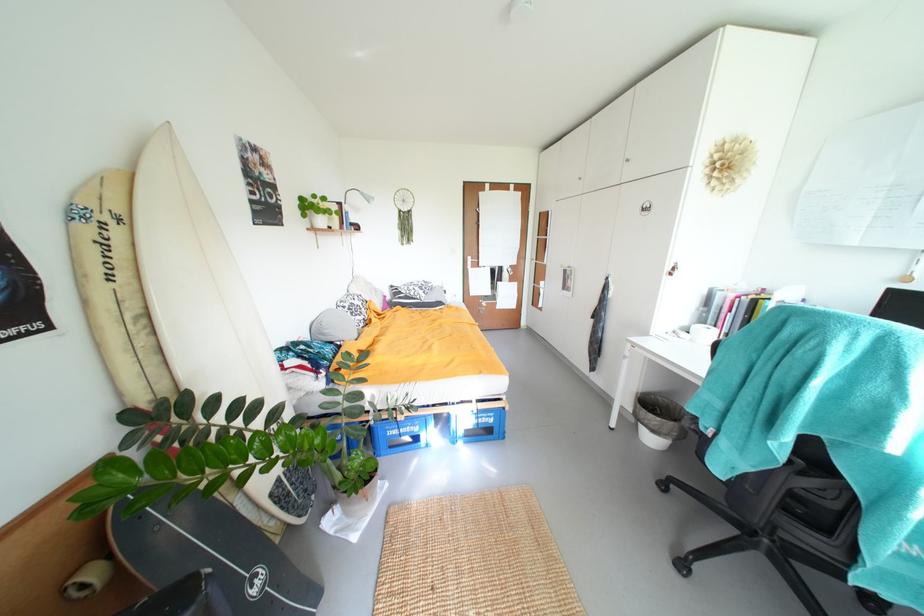
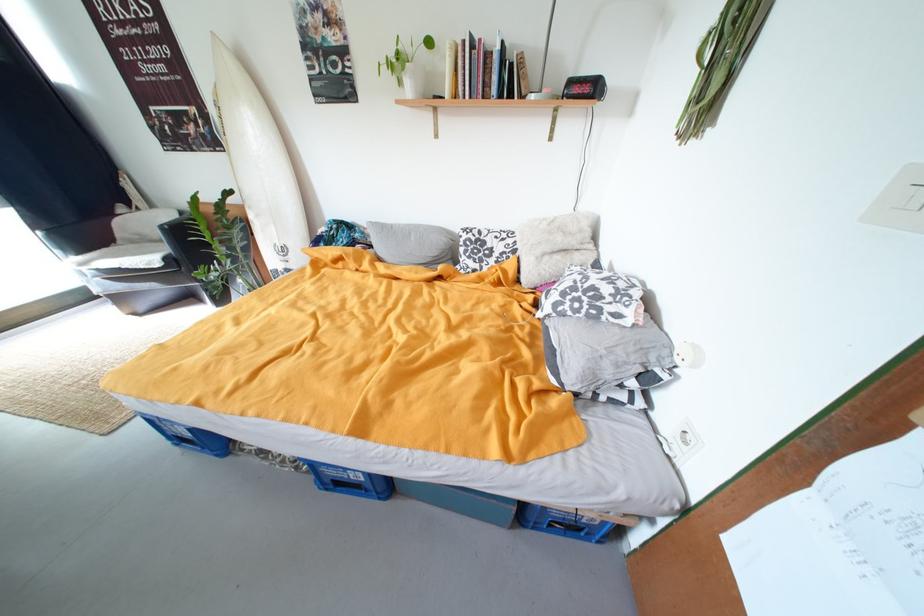
Where in the second image is the point corresponding to (x=113, y=223) from the first image?

(225, 108)